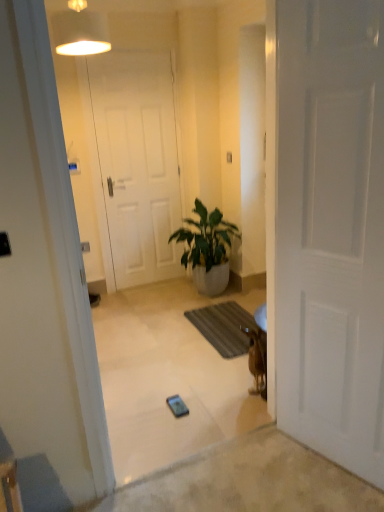
Locate an element on the screen. This screenshot has width=384, height=512. vacant space that is to the left of brown furry dog at right is located at coordinates 226,394.